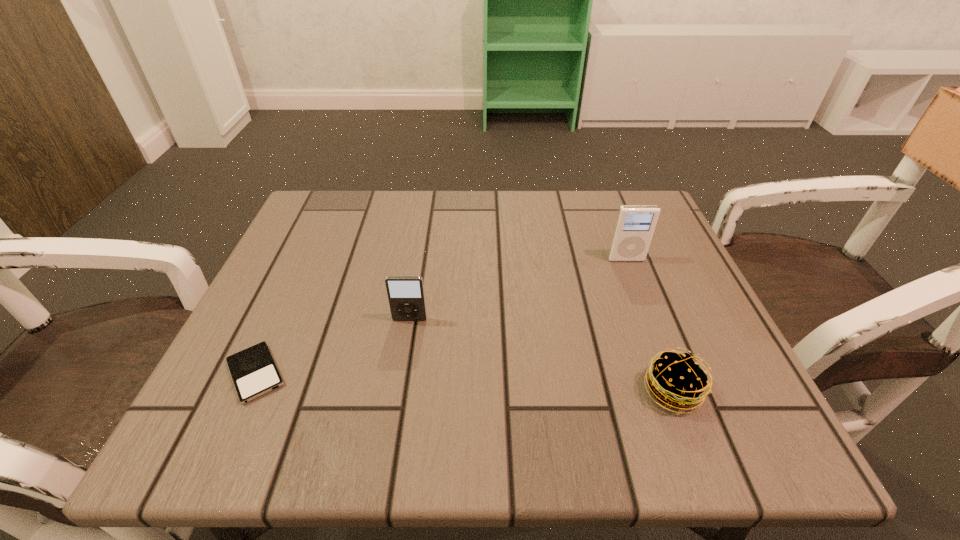
Find the location of a particular element. The width and height of the screenshot is (960, 540). the rightmost iPod is located at coordinates 635,224.

What are the coordinates of `the farthest object` in the screenshot? It's located at (635, 224).

This screenshot has height=540, width=960. Find the location of `the second object from left to right`. the second object from left to right is located at coordinates click(406, 297).

Where is `the second tallest object`? This screenshot has height=540, width=960. the second tallest object is located at coordinates (406, 297).

You are a GUI agent. You are given a task and a screenshot of the screen. Output one action in this format:
    pyautogui.click(x=<x>, y=<y>)
    Task: Click on the patty
    This screenshot has width=960, height=540.
    Given the screenshot: What is the action you would take?
    pyautogui.click(x=676, y=380)

This screenshot has height=540, width=960. In order to click on the shortest iPod in this screenshot , I will do `click(254, 372)`.

Identify the location of the leftmost object. point(254,372).

Where is `free region located 0.320m on the front-facing side of the tallest iPod`? The width and height of the screenshot is (960, 540). free region located 0.320m on the front-facing side of the tallest iPod is located at coordinates (677, 393).

At what (x,y) coordinates should I click in order to perform the action: click on vacant space positioned on the front-facing side of the second iPod from left to right. Please return your answer as a coordinate pair (x, y). The image size is (960, 540). Looking at the image, I should click on (394, 421).

Locate an element on the screen. vacant space situated 0.360m on the back of the patty is located at coordinates (614, 237).